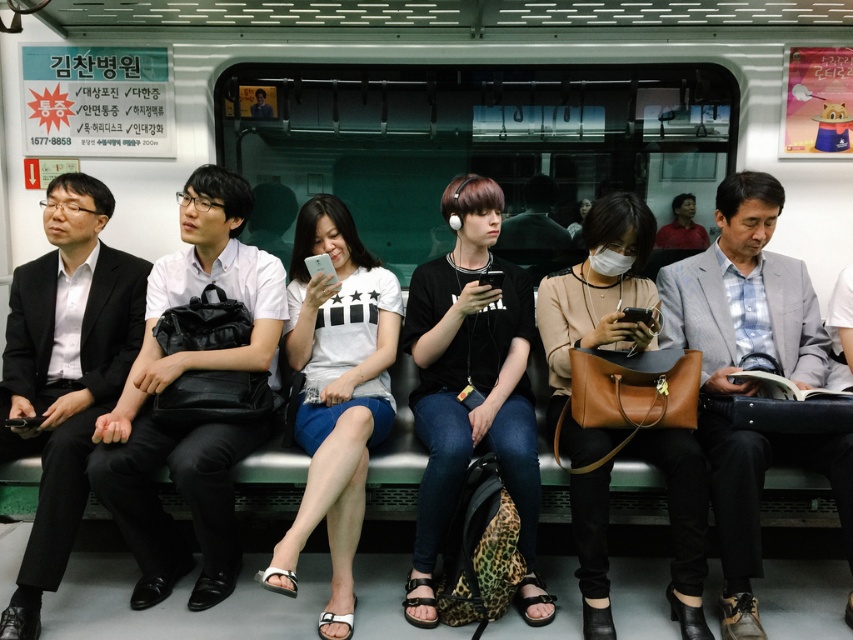
Where is `gray fabric suit at right`? gray fabric suit at right is located at coordinates [744, 294].

Is point (733, 314) closer to camera compared to point (450, 468)?

That is False.

You are a GUI agent. You are given a task and a screenshot of the screen. Output one action in this format:
    pyautogui.click(x=<x>, y=<y>)
    Task: Click on the gray fabric suit at right
    The height and width of the screenshot is (640, 853).
    Given the screenshot: What is the action you would take?
    coord(744,294)

Does matte black backpack at left have a greater width compared to black suit at left?

Indeed, matte black backpack at left has a greater width compared to black suit at left.

Who is more distant from viewer, [202,468] or [67,332]?

The point [67,332] is behind.

Between point (193, 202) and point (30, 289), which one is positioned behind?

The point (30, 289) is behind.

Image resolution: width=853 pixels, height=640 pixels. Identify the location of matte black backpack at left. tap(193, 422).

Can you confirm if black suit at left is wider than matte black shirt at center?

Yes.

Does black suit at left appear on the left side of matte black shirt at center?

Correct, you'll find black suit at left to the left of matte black shirt at center.

Who is more distant from viewer, (x=18, y=433) or (x=492, y=296)?

Point (x=492, y=296)

Find the location of a particular element. Image resolution: width=853 pixels, height=640 pixels. black suit at left is located at coordinates (64, 372).